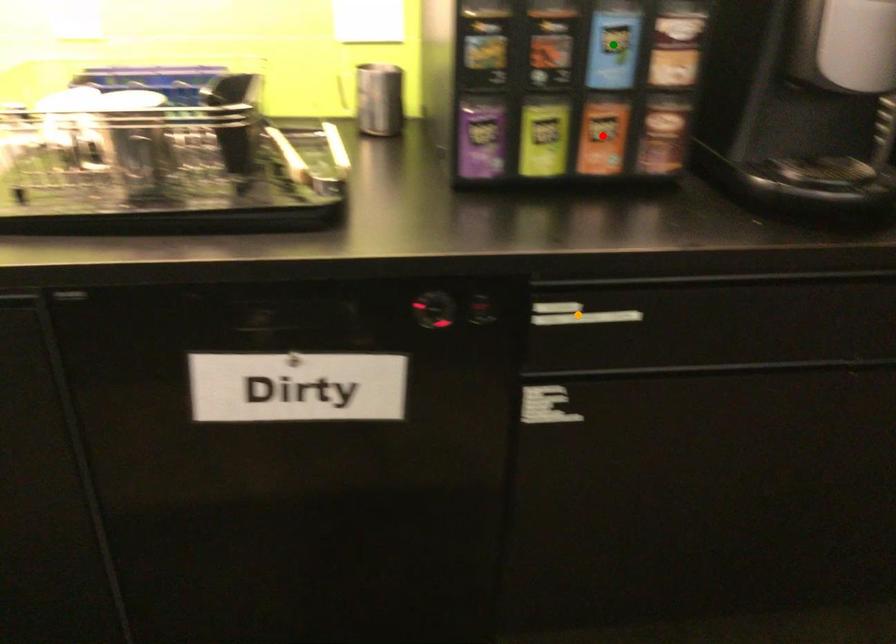
Order these from nearest to farthest:
green point, red point, orange point

red point → green point → orange point